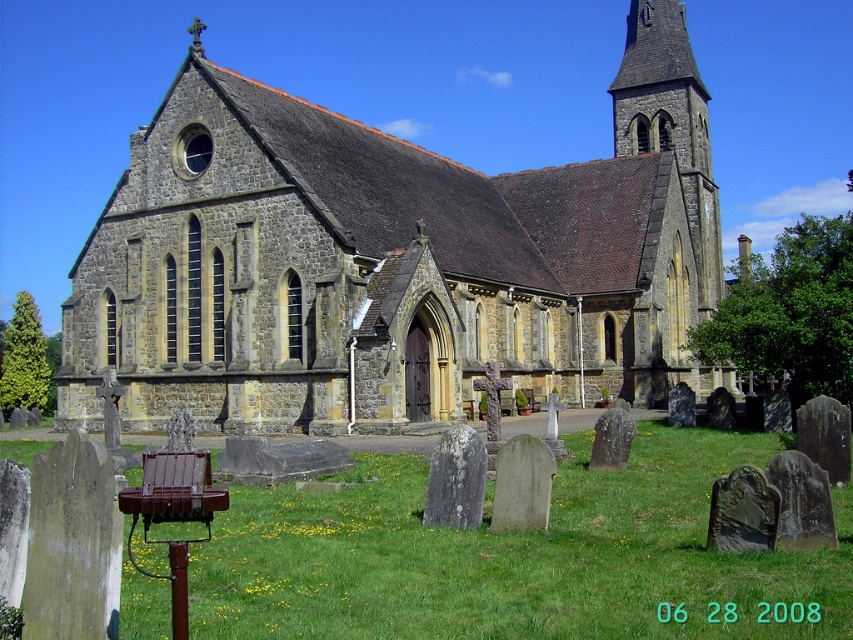
You are standing at the entrance of the stone church at center and want to place a new flower arrangement at the smooth gray stone gravestone at center. Can you walk directly to the gravestone without going around the church?

→ The smooth gray stone gravestone at center is behind the stone church at center, so you would need to walk around the church to reach it.

Looking at this image, you are a visitor at the cemetery and want to take a photo of the stone church at center and the gray stone gravestone at center. Which object will appear bigger in the photo?

The stone church at center will appear bigger in the photo because it has a larger size compared to the gray stone gravestone at center.